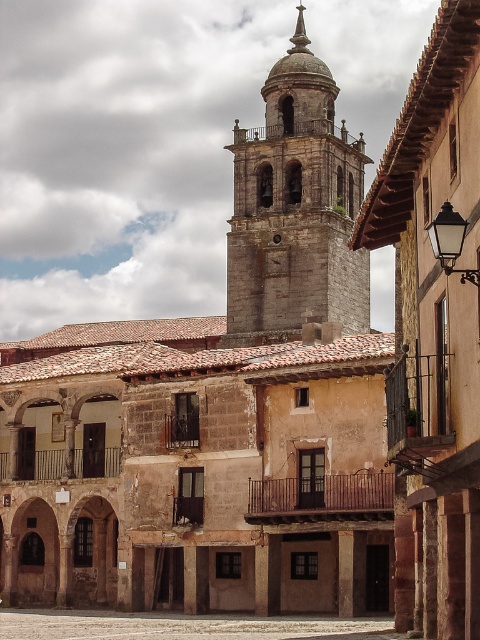
You are standing in the historic European town square and want to take a photo of the bell tower. You notice a specific point in the scene marked as point (332, 172). If you move 300 feet closer to this point, will you be able to capture the entire bell tower in your photo?

The distance between point (332, 172) and the camera is 344.93 feet. Moving 300 feet closer would leave you 44.93 feet away from the point. Since the bell tower is in the background and the point is part of the foreground, moving closer to the point would bring you nearer to the bell tower, potentially allowing you to capture more of it in the photo. However, whether the entire tower fits depends on your camera angle and lens. The question doesn not provide enough information about the camera specs or the

You are an architect visiting the town square and want to take a photo of both the gray stone bell tower at upper center and the smooth stone courtyard at center. Which object should you focus on first to ensure both are in frame?

The gray stone bell tower at upper center has a larger size compared to the smooth stone courtyard at center, so you should focus on the gray stone bell tower at upper center first to ensure both are in frame.

You are standing in the town square and want to take a photo of the gray stone bell tower at upper center. If your camera can only focus on objects within a 0.2 radius around the center point of the viewfinder, is the bell tower within the focus range?

The gray stone bell tower at upper center is located at point (295, 211), which is outside the 0.2 radius from the center point of the viewfinder. Therefore, it will not be within the focus range.